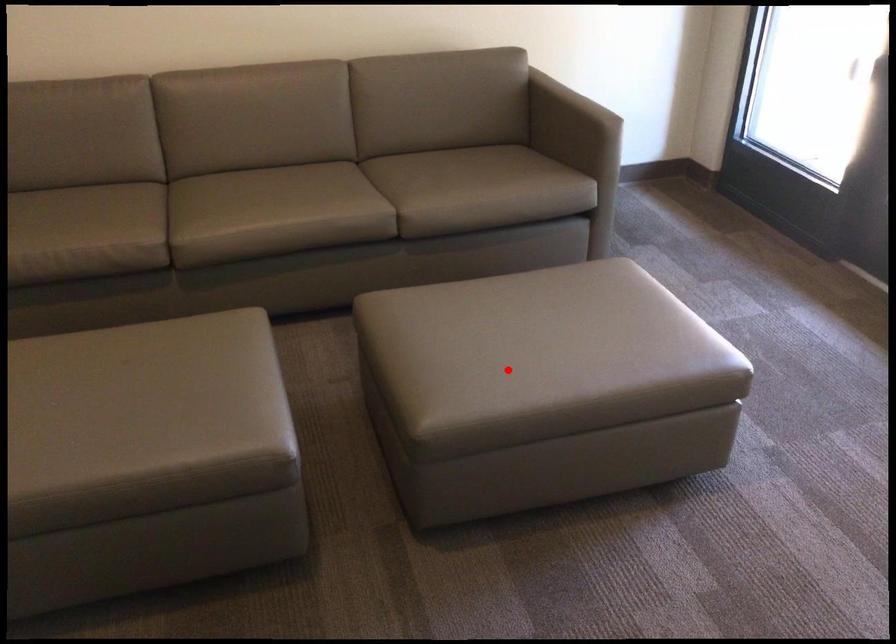
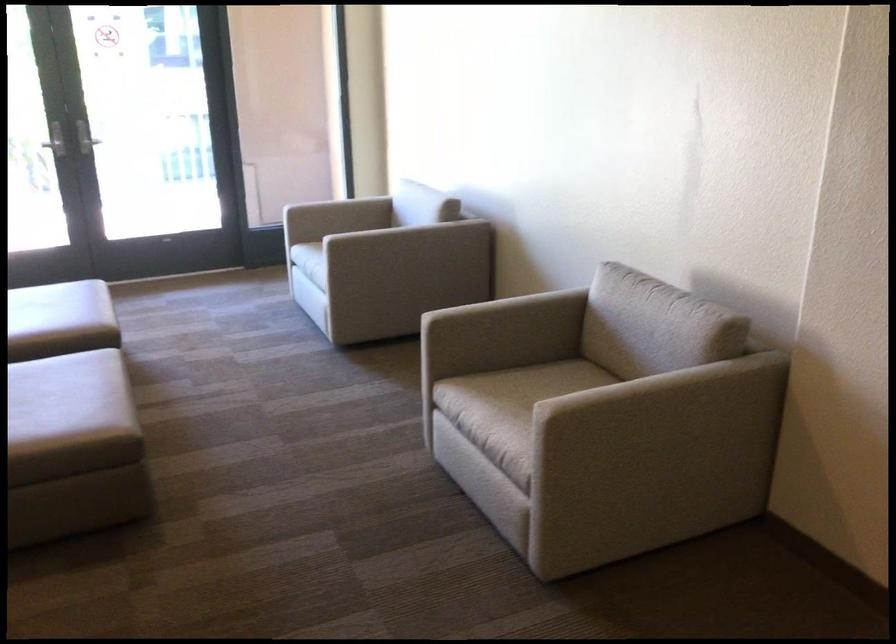
Find the pixel in the second image that matches the highlighted location in the first image.

(58, 308)